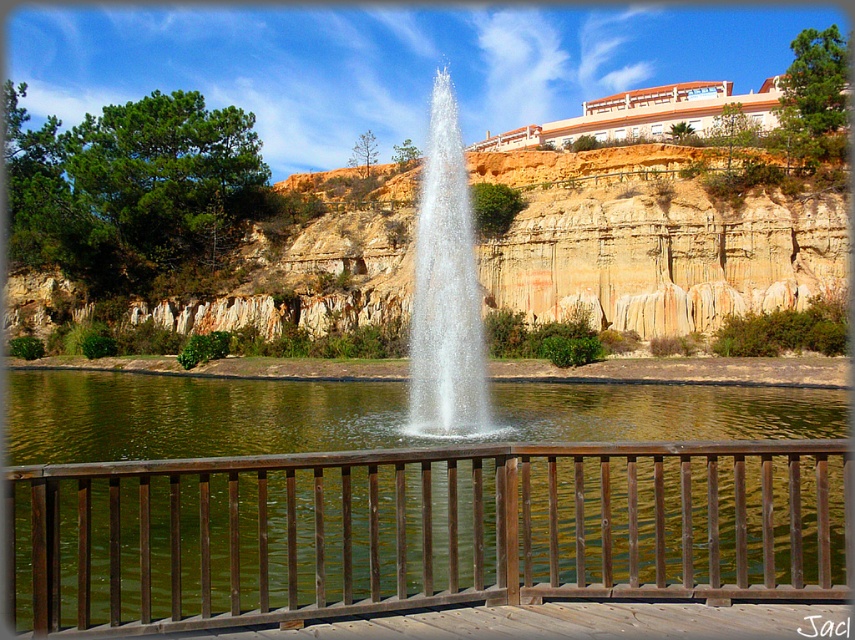
Question: Considering the relative positions of clay-colored rock at center and clear water fountain at center in the image provided, where is clay-colored rock at center located with respect to clear water fountain at center?

Choices:
 (A) above
 (B) below

Answer: (B)

Question: In this image, where is brown wooden railing at center located relative to clear water fountain at center?

Choices:
 (A) right
 (B) left

Answer: (A)

Question: Which point appears farthest from the camera in this image?

Choices:
 (A) (781, 227)
 (B) (172, 595)
 (C) (414, 412)

Answer: (A)

Question: Can you confirm if clay-colored rock at center is bigger than clear water fountain at center?

Choices:
 (A) yes
 (B) no

Answer: (A)

Question: Which point is farther from the camera taking this photo?

Choices:
 (A) (339, 579)
 (B) (473, 410)

Answer: (B)

Question: Among these points, which one is farthest from the camera?

Choices:
 (A) (441, 298)
 (B) (122, 509)

Answer: (A)